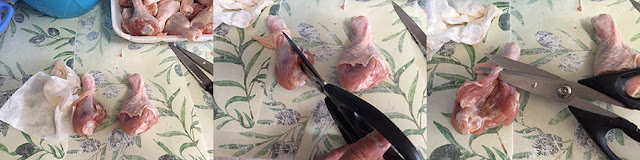
Locate an element on the screen. This screenshot has width=640, height=160. flower designs on tablecloth is located at coordinates 38,37, 285,115, 543,142.